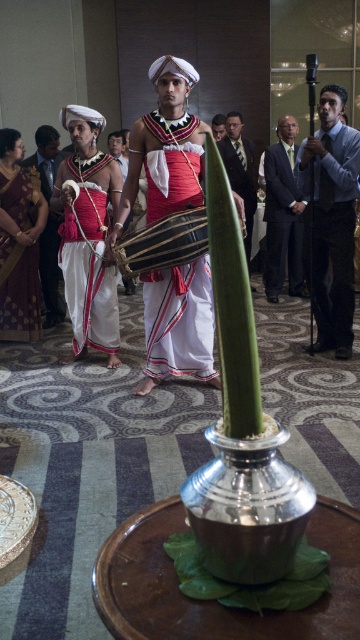
You are standing at the entrance of the event venue and want to find the dark gray suit at center. Based on the coordinates provided, in which direction should you look to locate it?

The dark gray suit at center is located at coordinates point (282, 212), which means it is positioned slightly to the left and lower center of the image.

You are standing in front of the scene and want to determine which of the two points, point [69,300] or point [28,198], is closer to you. Can you tell me which one is nearer based on their positions?

Point [69,300] is closer to the viewer than point [28,198] according to the spatial description provided.

You are a photographer at the event and need to capture a closeup of both the matte red cloth at left and the maroon silk saree at left. Your camera can only focus on objects within a 20 inch range. Can you fit both items in the frame without moving the camera?

The matte red cloth at left and maroon silk saree at left are 22.54 inches apart from each other. Since the distance between them exceeds the camera focus range of 20 inches, you cannot fit both items in the frame without moving the camera.